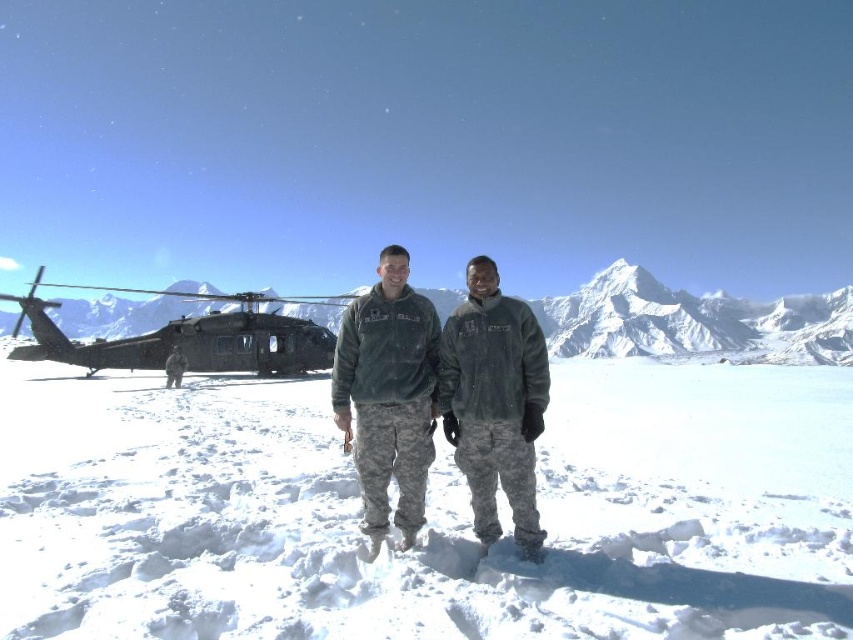
Based on the photo, you are a photographer positioned at the edge of the snowy field. You want to take a closeup shot of the green matte jacket at center. Given that your camera has a maximum zoom range of 50 meters, can you capture the jacket clearly?

The green matte jacket at center is 59.40 meters from the viewer, which exceeds the camera maximum zoom range of 50 meters. Therefore, the photographer cannot capture the jacket clearly.

You are a photographer trying to capture a clear photo of the green fleece jacket at center. However, the white powdery snow at center is in the way. Can you tell me if the snow is wider than the jacket so I know if I need to adjust my camera angle?

The white powdery snow at center might be wider than green fleece jacket at center, so adjusting the camera angle might be necessary to ensure the jacket is fully visible without obstruction.